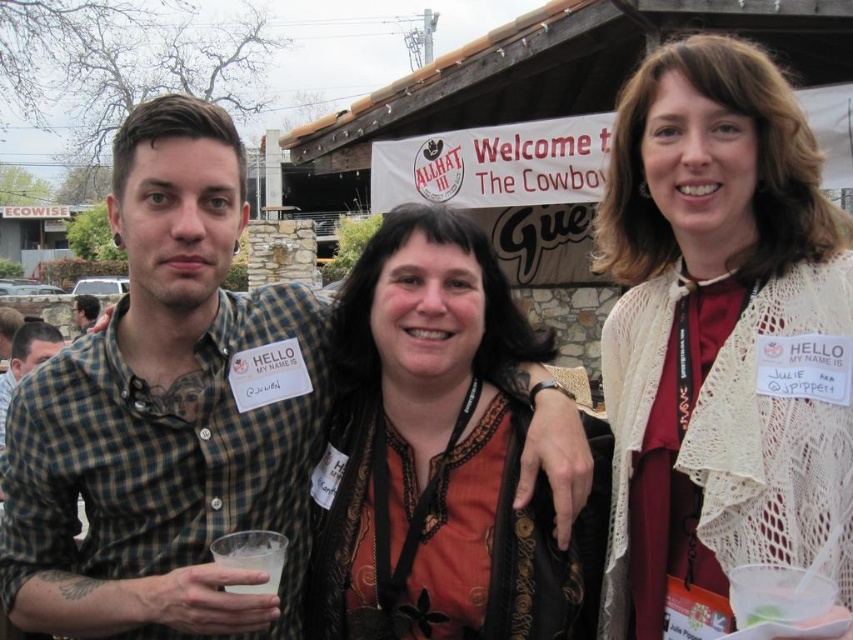
Question: Does white lace shawl at center appear on the left side of checkered fabric shirt at center?

Choices:
 (A) yes
 (B) no

Answer: (B)

Question: Among these points, which one is farthest from the camera?

Choices:
 (A) (799, 424)
 (B) (366, 291)

Answer: (B)

Question: Is checkered fabric shirt at center positioned behind orange fabric shirt at center?

Choices:
 (A) yes
 (B) no

Answer: (B)

Question: Among these points, which one is farthest from the camera?

Choices:
 (A) coord(129,198)
 (B) coord(764,344)
 (C) coord(90,312)
 (D) coord(448,632)

Answer: (C)

Question: Is white lace shawl at center below checkered fabric shirt at center?

Choices:
 (A) yes
 (B) no

Answer: (B)

Question: Which point is closer to the camera taking this photo?

Choices:
 (A) (177, 472)
 (B) (672, 458)
 (C) (73, 300)

Answer: (B)